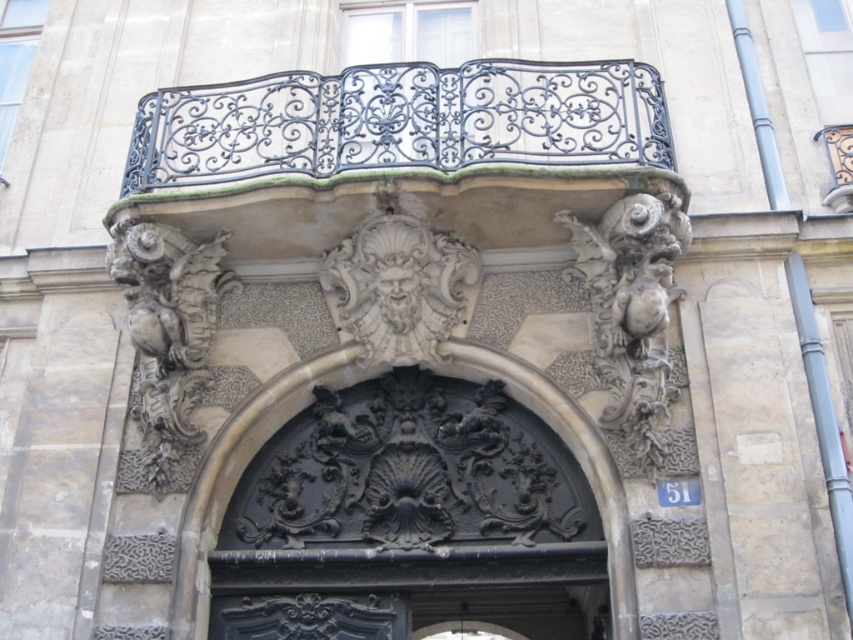
Does polished stone cherub at center have a greater height compared to white stone sculpture at center?

Correct, polished stone cherub at center is much taller as white stone sculpture at center.

Can you confirm if polished stone cherub at center is positioned to the right of white stone sculpture at center?

Correct, you'll find polished stone cherub at center to the right of white stone sculpture at center.

Who is more distant from viewer, (590, 259) or (358, 321)?

Point (358, 321)

Where is `polished stone cherub at center`? The image size is (853, 640). polished stone cherub at center is located at coordinates (631, 310).

Describe the element at coordinates (631, 310) in the screenshot. The width and height of the screenshot is (853, 640). I see `polished stone cherub at center` at that location.

Is polished stone cherub at center to the right of dark gray stone lion at center from the viewer's perspective?

Indeed, polished stone cherub at center is positioned on the right side of dark gray stone lion at center.

Which is behind, point (643, 384) or point (158, 305)?

Point (158, 305)

Locate an element on the screen. polished stone cherub at center is located at coordinates (631, 310).

Which of these two, black wrought iron balcony at upper center or polished stone cherub at center, stands shorter?

With less height is black wrought iron balcony at upper center.

Does black wrought iron balcony at upper center appear over polished stone cherub at center?

Yes, black wrought iron balcony at upper center is above polished stone cherub at center.

Is point (207, 104) behind point (624, 282)?

Yes, it is.

Find the location of a particular element. The width and height of the screenshot is (853, 640). black wrought iron balcony at upper center is located at coordinates (399, 122).